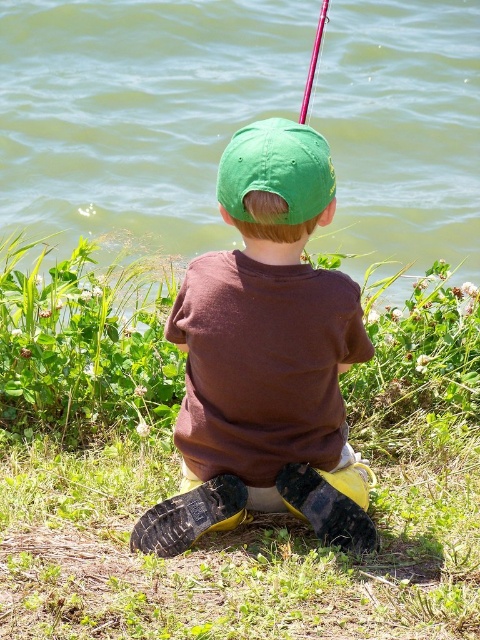
Is green matte cap at center thinner than green fabric cap at center?

In fact, green matte cap at center might be wider than green fabric cap at center.

The width and height of the screenshot is (480, 640). What do you see at coordinates (264, 353) in the screenshot?
I see `green matte cap at center` at bounding box center [264, 353].

I want to click on green matte cap at center, so click(264, 353).

Between point (242, 218) and point (300, 108), which one is positioned in front?

Positioned in front is point (242, 218).

Where is `green fabric cap at center`? This screenshot has height=640, width=480. green fabric cap at center is located at coordinates (276, 170).

Image resolution: width=480 pixels, height=640 pixels. I want to click on green fabric cap at center, so click(x=276, y=170).

Does green grass at center appear over green fabric cap at center?

Incorrect, green grass at center is not positioned above green fabric cap at center.

Is green grass at center smaller than green fabric cap at center?

No, green grass at center is not smaller than green fabric cap at center.

The image size is (480, 640). Find the location of `green grass at center`. green grass at center is located at coordinates (178, 467).